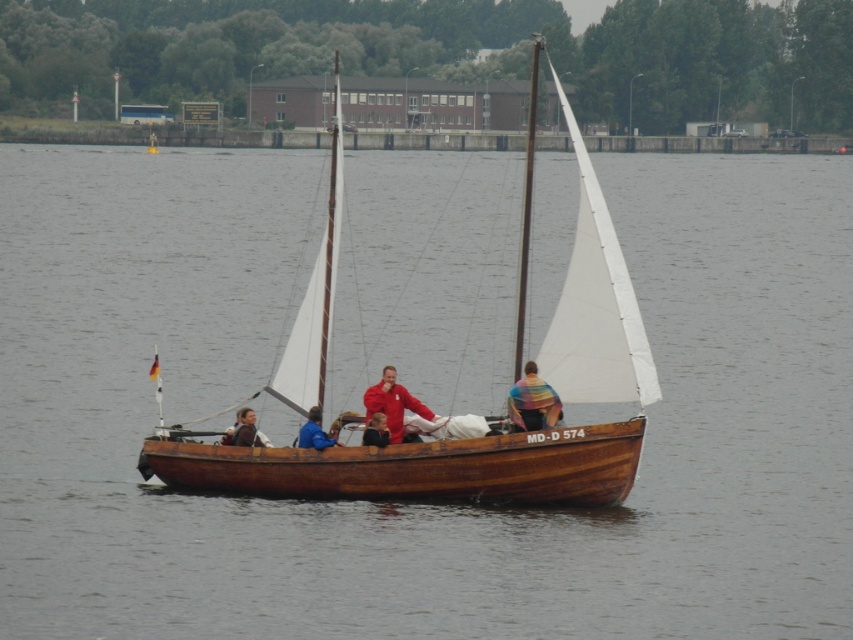
You are a passenger on the wooden sailboat at center and want to hand a life jacket to the person wearing the blue fabric jacket at center. Considering the distance between you and them, is it possible to throw the life jacket to them without leaving the boat?

The distance between the wooden sailboat at center and the blue fabric jacket at center is 54.48 feet. Since this distance is quite large, it would be difficult to accurately throw a life jacket that far without risking it missing the target. It is advisable to move closer or use another method to deliver the life jacket safely.

You are standing on a dock and see the wooden sailboat at center in the distance. If you want to take a photo of it with your camera, which has a maximum zoom range of 50 meters, will you be able to capture the boat clearly?

The wooden sailboat at center and camera are 73.01 meters apart, which exceeds the camera maximum zoom range of 50 meters. Therefore, you will not be able to capture the boat clearly.